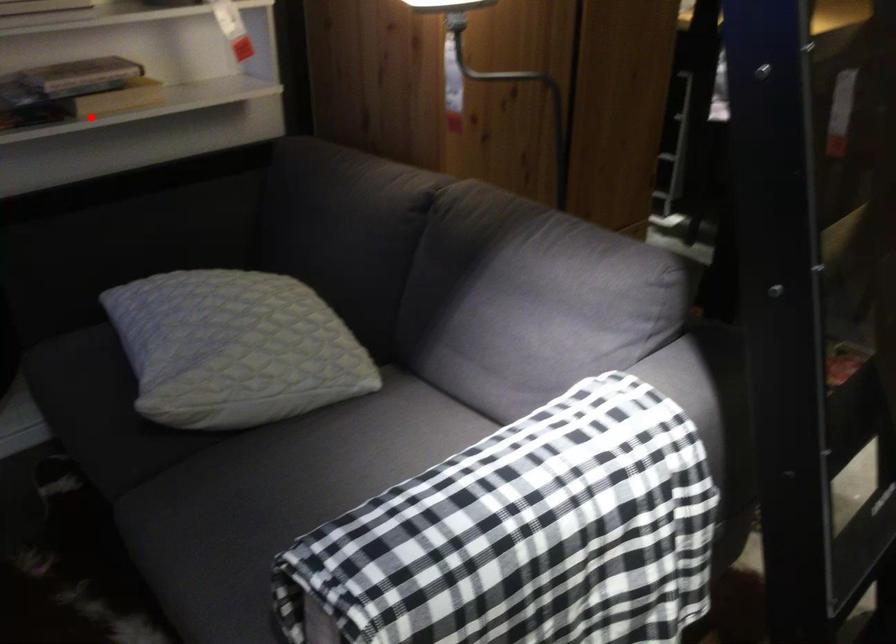
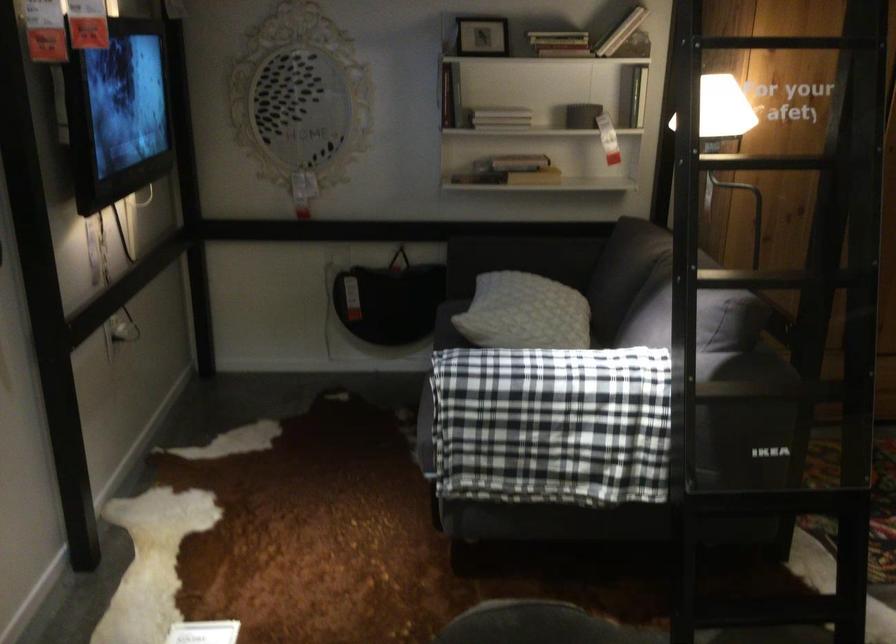
Question: I am providing you with two images of the same scene from different viewpoints. In image1, a red point is highlighted. Considering the same 3D point in image2, which of the following is correct?

Choices:
 (A) It is closer
 (B) It is farther

Answer: (B)